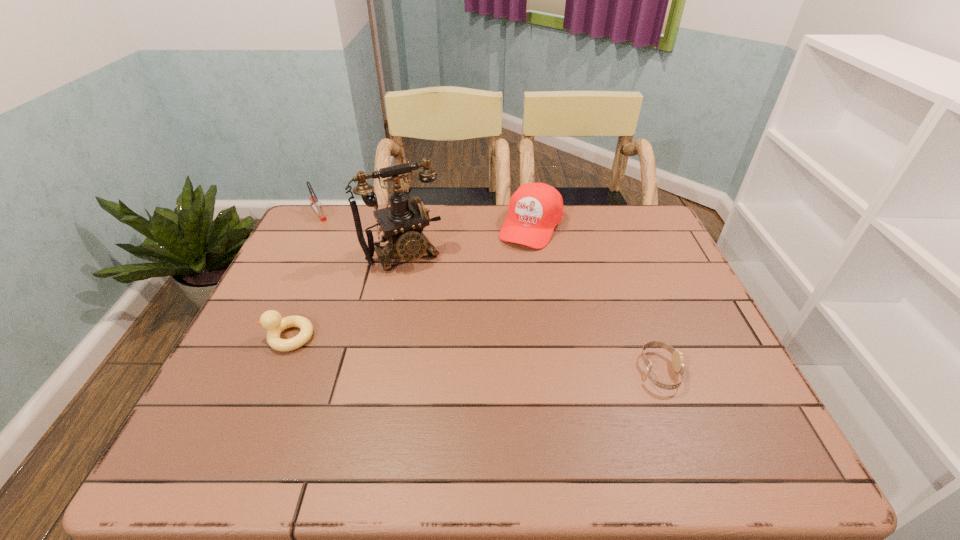
You are a GUI agent. You are given a task and a screenshot of the screen. Output one action in this format:
    pyautogui.click(x=<x>, y=<y>)
    Task: Click on the duckling
    
    Given the screenshot: What is the action you would take?
    [271, 320]

Image resolution: width=960 pixels, height=540 pixels. I want to click on the shortest object, so click(x=677, y=356).

Find the location of a particular element. watch is located at coordinates (677, 356).

Locate an element on the screen. telephone is located at coordinates (402, 223).

In order to click on the tallest object in this screenshot , I will do `click(402, 223)`.

Locate an element on the screen. the fourth shortest object is located at coordinates (534, 210).

I want to click on baseball cap, so click(534, 210).

This screenshot has width=960, height=540. What are the coordinates of `stapler` in the screenshot? It's located at (317, 206).

Find the location of a particular element. The height and width of the screenshot is (540, 960). vacant area located at the beak of the duckling is located at coordinates tap(243, 337).

Identify the location of free space located 0.050m on the face of the shortest object. Image resolution: width=960 pixels, height=540 pixels. [701, 371].